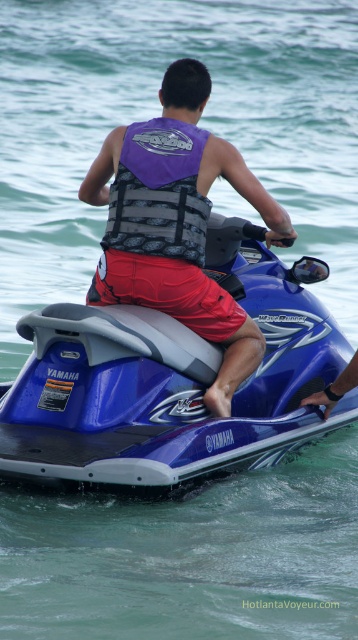
Question: Among these objects, which one is nearest to the camera?

Choices:
 (A) purple fabric life vest at center
 (B) blue metallic jet ski at center

Answer: (B)

Question: Can you confirm if blue metallic jet ski at center is positioned to the left of purple fabric life vest at center?

Choices:
 (A) no
 (B) yes

Answer: (A)

Question: Is purple fabric life vest at center below purple fabric life jacket at center?

Choices:
 (A) no
 (B) yes

Answer: (B)

Question: Is blue metallic jet ski at center to the right of purple fabric life jacket at center from the viewer's perspective?

Choices:
 (A) yes
 (B) no

Answer: (A)

Question: Which object appears farthest from the camera in this image?

Choices:
 (A) blue metallic jet ski at center
 (B) purple fabric life jacket at center

Answer: (B)

Question: Which point is farther from the camera taking this photo?

Choices:
 (A) (118, 272)
 (B) (302, 355)
 (C) (137, 157)

Answer: (B)